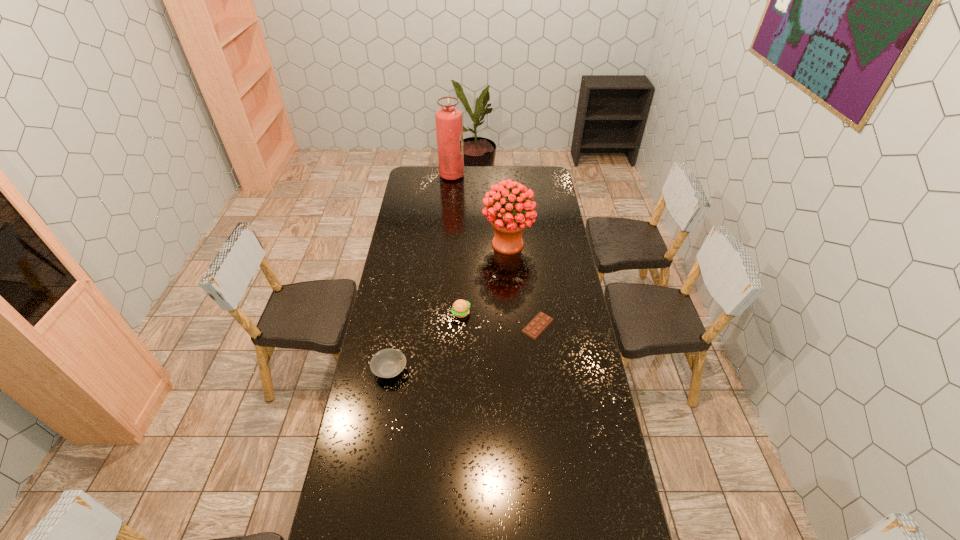
I want to click on blank area located on the right of the third shortest object, so [561, 313].

Where is `free spot located 0.280m on the right of the second shortest object`? free spot located 0.280m on the right of the second shortest object is located at coordinates [480, 370].

At what (x,y) coordinates should I click in order to perform the action: click on vacant space located 0.110m on the front of the chocolate bar. Please return your answer as a coordinate pair (x, y). The width and height of the screenshot is (960, 540). Looking at the image, I should click on (542, 363).

You are a GUI agent. You are given a task and a screenshot of the screen. Output one action in this format:
    pyautogui.click(x=<x>, y=<y>)
    Task: Click on the object that is at the far edge
    This screenshot has height=540, width=960.
    Given the screenshot: What is the action you would take?
    pyautogui.click(x=449, y=122)

At what (x,y) coordinates should I click in order to perform the action: click on object that is at the left edge. Please return your answer as a coordinate pair (x, y). Looking at the image, I should click on (387, 363).

Image resolution: width=960 pixels, height=540 pixels. I want to click on object that is at the right edge, so click(541, 321).

In the image, there is a desktop. Find the location of `free space at the far edge`. free space at the far edge is located at coordinates (494, 181).

In the image, there is a desktop. Find the location of `free space at the left edge`. free space at the left edge is located at coordinates (420, 206).

The image size is (960, 540). I want to click on free space at the right edge, so click(x=572, y=376).

The height and width of the screenshot is (540, 960). In the image, there is a desktop. Identify the location of vacant space at the far right corner. (548, 167).